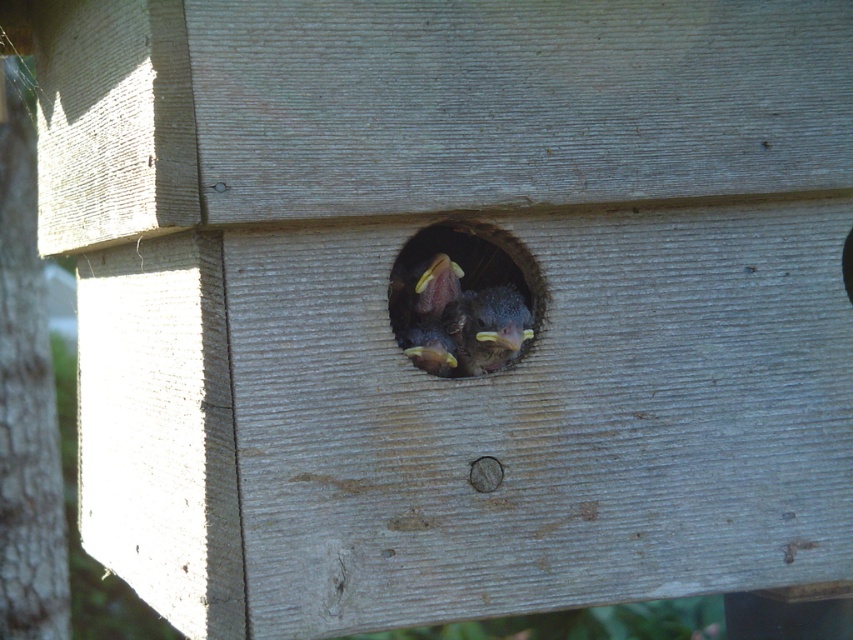
Question: Among these objects, which one is nearest to the camera?

Choices:
 (A) smooth brown bird at center
 (B) smooth wood hole at center

Answer: (B)

Question: Which of the following is the closest to the observer?

Choices:
 (A) (413, 332)
 (B) (511, 307)

Answer: (A)

Question: Is smooth wood hole at center further to the viewer compared to smooth brown bird at center?

Choices:
 (A) no
 (B) yes

Answer: (A)

Question: Which point appears closest to the camera in this image?

Choices:
 (A) (515, 282)
 (B) (525, 320)

Answer: (B)

Question: Can you confirm if smooth wood hole at center is smaller than smooth brown bird at center?

Choices:
 (A) no
 (B) yes

Answer: (A)

Question: Can you confirm if smooth wood hole at center is positioned above smooth brown bird at center?

Choices:
 (A) yes
 (B) no

Answer: (A)